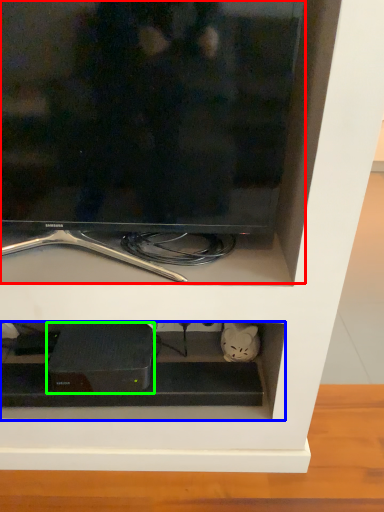
Question: Which is farther away from television (highlighted by a red box)? cabinet (highlighted by a blue box) or appliance (highlighted by a green box)?

Choices:
 (A) cabinet
 (B) appliance

Answer: (B)